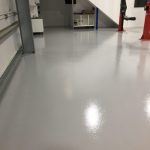
Find the location of a particular element. Image resolution: width=150 pixels, height=150 pixels. white wall is located at coordinates (110, 4), (142, 14), (13, 39), (4, 7), (54, 7), (103, 20), (83, 4).